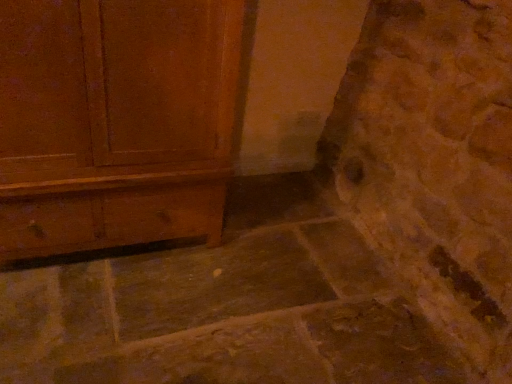
Image resolution: width=512 pixels, height=384 pixels. What are the coordinates of `vacant space to the right of matte wood chest of drawers at left` in the screenshot? It's located at (263, 259).